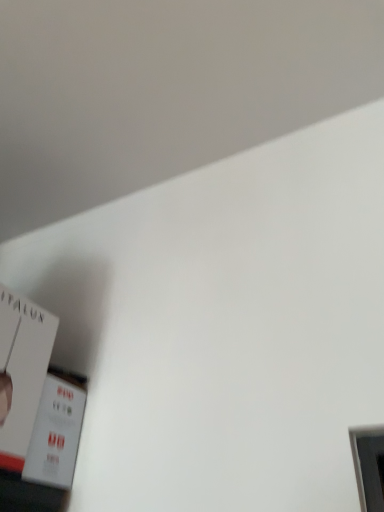
Question: Is white matte paper at lower left, the 1th paperback book in the top-to-bottom sequence, aimed at white matte paper at lower left, the second paperback book positioned from the top?

Choices:
 (A) no
 (B) yes

Answer: (A)

Question: Considering the relative positions of white matte paper at lower left, placed as the second paperback book when sorted from bottom to top, and white matte paper at lower left, marked as the first paperback book in a bottom-to-top arrangement, in the image provided, is white matte paper at lower left, placed as the second paperback book when sorted from bottom to top, to the right of white matte paper at lower left, marked as the first paperback book in a bottom-to-top arrangement, from the viewer's perspective?

Choices:
 (A) yes
 (B) no

Answer: (B)

Question: Considering the relative positions of white matte paper at lower left, placed as the second paperback book when sorted from bottom to top, and white matte paper at lower left, marked as the first paperback book in a bottom-to-top arrangement, in the image provided, is white matte paper at lower left, placed as the second paperback book when sorted from bottom to top, to the left of white matte paper at lower left, marked as the first paperback book in a bottom-to-top arrangement, from the viewer's perspective?

Choices:
 (A) yes
 (B) no

Answer: (A)

Question: Is the position of white matte paper at lower left, placed as the second paperback book when sorted from bottom to top, more distant than that of white matte paper at lower left, the second paperback book positioned from the top?

Choices:
 (A) yes
 (B) no

Answer: (B)

Question: Can you confirm if white matte paper at lower left, the 1th paperback book in the top-to-bottom sequence, is thinner than white matte paper at lower left, marked as the first paperback book in a bottom-to-top arrangement?

Choices:
 (A) yes
 (B) no

Answer: (B)

Question: Does white matte paper at lower left, placed as the second paperback book when sorted from bottom to top, have a larger size compared to white matte paper at lower left, marked as the first paperback book in a bottom-to-top arrangement?

Choices:
 (A) no
 (B) yes

Answer: (B)

Question: Is white matte paper at lower left, marked as the first paperback book in a bottom-to-top arrangement, outside of white matte paper at lower left, placed as the second paperback book when sorted from bottom to top?

Choices:
 (A) yes
 (B) no

Answer: (A)

Question: Does white matte paper at lower left, marked as the first paperback book in a bottom-to-top arrangement, appear on the left side of white matte paper at lower left, the 1th paperback book in the top-to-bottom sequence?

Choices:
 (A) no
 (B) yes

Answer: (A)

Question: Is white matte paper at lower left, the second paperback book positioned from the top, positioned behind white matte paper at lower left, placed as the second paperback book when sorted from bottom to top?

Choices:
 (A) yes
 (B) no

Answer: (A)

Question: Is white matte paper at lower left, placed as the second paperback book when sorted from bottom to top, at the back of white matte paper at lower left, the second paperback book positioned from the top?

Choices:
 (A) no
 (B) yes

Answer: (A)

Question: Is white matte paper at lower left, marked as the first paperback book in a bottom-to-top arrangement, aimed at white matte paper at lower left, placed as the second paperback book when sorted from bottom to top?

Choices:
 (A) no
 (B) yes

Answer: (A)

Question: Can you confirm if white matte paper at lower left, the second paperback book positioned from the top, is smaller than white matte paper at lower left, the 1th paperback book in the top-to-bottom sequence?

Choices:
 (A) no
 (B) yes

Answer: (B)

Question: From a real-world perspective, is white matte paper at lower left, placed as the second paperback book when sorted from bottom to top, positioned above or below white matte paper at lower left, marked as the first paperback book in a bottom-to-top arrangement?

Choices:
 (A) below
 (B) above

Answer: (B)